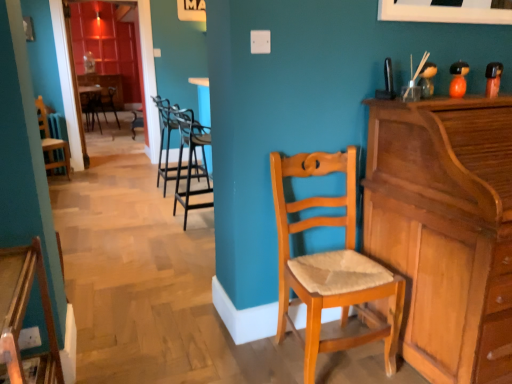
This screenshot has height=384, width=512. Identify the location of vacant space in front of black metal barstools at center, positioned as the third chair in left-to-right order. (157, 206).